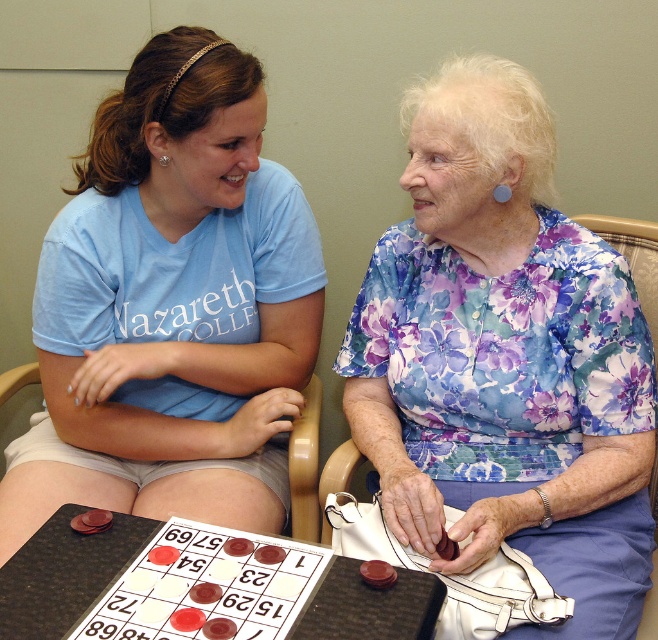
Who is positioned more to the left, translucent plastic board at center or wooden chair at center?

translucent plastic board at center

Who is more distant from viewer, (84, 548) or (297, 493)?

The point (297, 493) is more distant.

Where is `translucent plastic board at center`? translucent plastic board at center is located at coordinates (195, 584).

Which is below, floral fabric blouse at upper right or wooden chair at center?

wooden chair at center

Where is `floral fabric blouse at upper right`? This screenshot has width=658, height=640. floral fabric blouse at upper right is located at coordinates (170, 307).

Can you confirm if floral fabric blouse at center is positioned below translucent plastic board at center?

No.

Between floral fabric blouse at center and translucent plastic board at center, which one has less height?

translucent plastic board at center

Locate an element on the screen. floral fabric blouse at center is located at coordinates (503, 356).